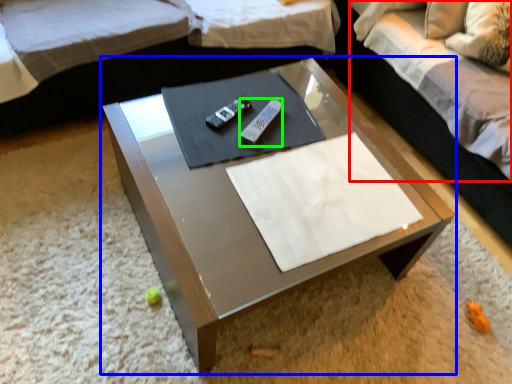
Question: Based on their relative distances, which object is farther from bedding (highlighted by a red box)? Choose from coffee table (highlighted by a blue box) and remote (highlighted by a green box).

Choices:
 (A) coffee table
 (B) remote

Answer: (B)